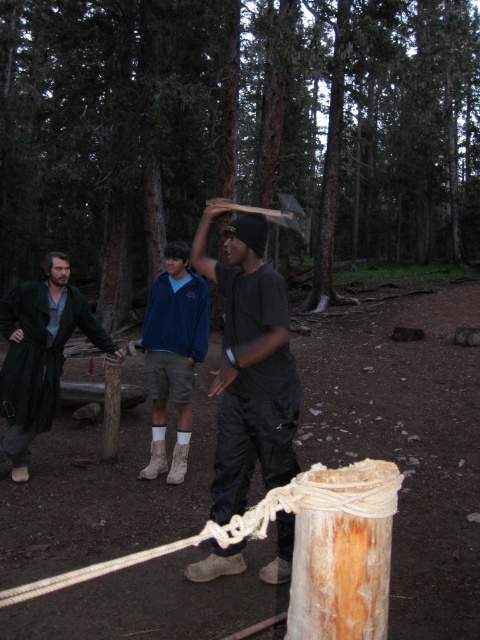
Is brown wood post at center above black matte shirt at center?

Correct, brown wood post at center is located above black matte shirt at center.

Can you confirm if brown wood post at center is wider than black matte shirt at center?

Correct, the width of brown wood post at center exceeds that of black matte shirt at center.

Is point (100, 106) behind point (269, 296)?

That is True.

You are a GUI agent. You are given a task and a screenshot of the screen. Output one action in this format:
    pyautogui.click(x=<x>, y=<y>)
    Task: Click on the brown wood post at center
    The height and width of the screenshot is (640, 480).
    Given the screenshot: What is the action you would take?
    pyautogui.click(x=236, y=132)

Does brown wood post at center come behind green wool coat at left?

Yes, it is behind green wool coat at left.

Does brown wood post at center have a greater width compared to green wool coat at left?

Indeed, brown wood post at center has a greater width compared to green wool coat at left.

Is point (196, 211) behind point (56, 394)?

Yes, it is behind point (56, 394).

Locate an element on the screen. The image size is (480, 640). brown wood post at center is located at coordinates (236, 132).

Who is shorter, brown wood post at center or white rope at center?

white rope at center is shorter.

Between brown wood post at center and white rope at center, which one appears on the left side from the viewer's perspective?

From the viewer's perspective, white rope at center appears more on the left side.

Where is `brown wood post at center`? The image size is (480, 640). brown wood post at center is located at coordinates (236, 132).